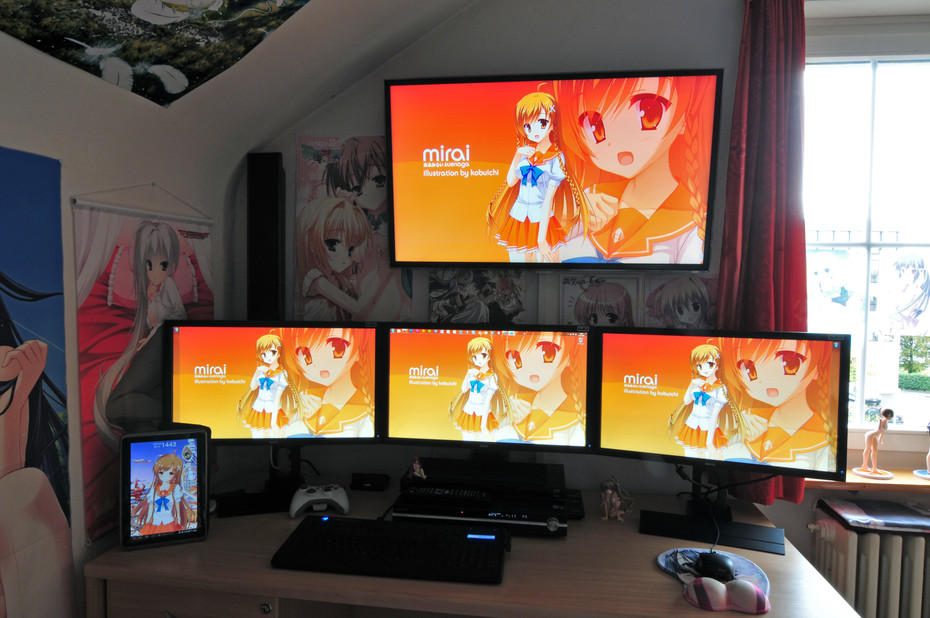
Locate an element on the screen. Image resolution: width=930 pixels, height=618 pixels. keyboard is located at coordinates (379, 544).